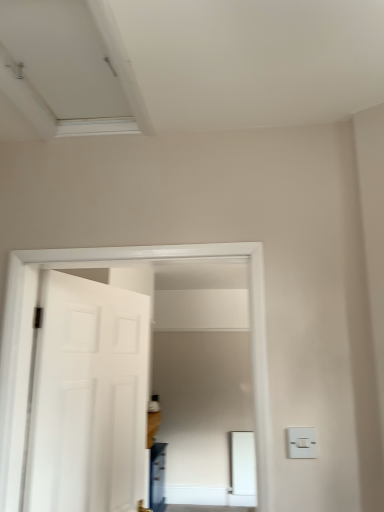
Locate an element on the screen. white matte door at left is located at coordinates (88, 398).

Describe the element at coordinates (88, 398) in the screenshot. I see `white matte door at left` at that location.

Describe the element at coordinates (301, 442) in the screenshot. The width and height of the screenshot is (384, 512). I see `white plastic light switch at lower right` at that location.

Locate an element on the screen. white matte door at left is located at coordinates pyautogui.click(x=88, y=398).

Is white plastic light switch at lower right completely or partially outside of white matte exhaust hood at upper left?

Yes, white plastic light switch at lower right is outside of white matte exhaust hood at upper left.

Is white plastic light switch at lower right in front of or behind white matte exhaust hood at upper left in the image?

Visually, white plastic light switch at lower right is located behind white matte exhaust hood at upper left.

From the image's perspective, would you say white plastic light switch at lower right is positioned over white matte exhaust hood at upper left?

No.

From the image's perspective, does white matte exhaust hood at upper left appear higher than white plastic light switch at lower right?

Correct, white matte exhaust hood at upper left appears higher than white plastic light switch at lower right in the image.

Which is closer to the camera, (115, 106) or (312, 442)?

Point (115, 106).

Does white matte exhaust hood at upper left turn towards white plastic light switch at lower right?

No, white matte exhaust hood at upper left is not aimed at white plastic light switch at lower right.

From the image's perspective, who appears lower, white matte exhaust hood at upper left or white matte door at left?

white matte door at left appears lower in the image.

This screenshot has height=512, width=384. I want to click on exhaust hood above the white matte door at left (from a real-world perspective), so click(x=69, y=69).

From a real-world perspective, which object rests below the other?

white matte door at left.

Considering the positions of objects white matte exhaust hood at upper left and white matte door at left in the image provided, who is behind, white matte exhaust hood at upper left or white matte door at left?

white matte door at left.

Considering the positions of objects white matte door at left and white matte exhaust hood at upper left in the image provided, who is more to the left, white matte door at left or white matte exhaust hood at upper left?

From the viewer's perspective, white matte door at left appears more on the left side.

Consider the image. Considering the relative sizes of white matte door at left and white matte exhaust hood at upper left in the image provided, is white matte door at left smaller than white matte exhaust hood at upper left?

No.

Where is `door behind the white matte exhaust hood at upper left`? The image size is (384, 512). door behind the white matte exhaust hood at upper left is located at coordinates (88, 398).

Looking at this image, from the image's perspective, is white matte door at left located above or below white plastic light switch at lower right?

white matte door at left is below white plastic light switch at lower right.

Considering the sizes of white matte door at left and white plastic light switch at lower right in the image, is white matte door at left taller or shorter than white plastic light switch at lower right?

Considering their sizes, white matte door at left has more height than white plastic light switch at lower right.

From a real-world perspective, which is physically above, white matte door at left or white plastic light switch at lower right?

white matte door at left.

Is point (114, 402) behind point (302, 448)?

That is True.

How many degrees apart are the facing directions of white plastic light switch at lower right and white matte door at left?

Answer: 73 degrees separate the facing orientations of white plastic light switch at lower right and white matte door at left.

Where is `door above the white plastic light switch at lower right (from a real-world perspective)`? This screenshot has width=384, height=512. door above the white plastic light switch at lower right (from a real-world perspective) is located at coordinates (88, 398).

From a real-world perspective, is white plastic light switch at lower right beneath white matte door at left?

Yes, from a real-world perspective, white plastic light switch at lower right is below white matte door at left.

Find the location of `exhaust hood in front of the white plastic light switch at lower right`. exhaust hood in front of the white plastic light switch at lower right is located at coordinates (69, 69).

I want to click on light switch that appears behind the white matte exhaust hood at upper left, so click(301, 442).

When comparing their distances from white matte exhaust hood at upper left, does white plastic light switch at lower right or white matte door at left seem further?

Among the two, white plastic light switch at lower right is located further to white matte exhaust hood at upper left.

Based on their spatial positions, is white matte exhaust hood at upper left or white plastic light switch at lower right further from white matte door at left?

white plastic light switch at lower right is positioned further to the anchor white matte door at left.

When comparing their distances from white plastic light switch at lower right, does white matte door at left or white matte exhaust hood at upper left seem further?

The object further to white plastic light switch at lower right is white matte exhaust hood at upper left.

Considering their positions, is white matte exhaust hood at upper left positioned further to white plastic light switch at lower right than white matte door at left?

white matte exhaust hood at upper left.

Estimate the real-world distances between objects in this image. Which object is further from white matte door at left, white plastic light switch at lower right or white matte exhaust hood at upper left?

white plastic light switch at lower right is further to white matte door at left.

Based on their spatial positions, is white matte door at left or white plastic light switch at lower right further from white matte exhaust hood at upper left?

white plastic light switch at lower right is further to white matte exhaust hood at upper left.

I want to click on light switch between white matte exhaust hood at upper left and white matte door at left vertically, so click(x=301, y=442).